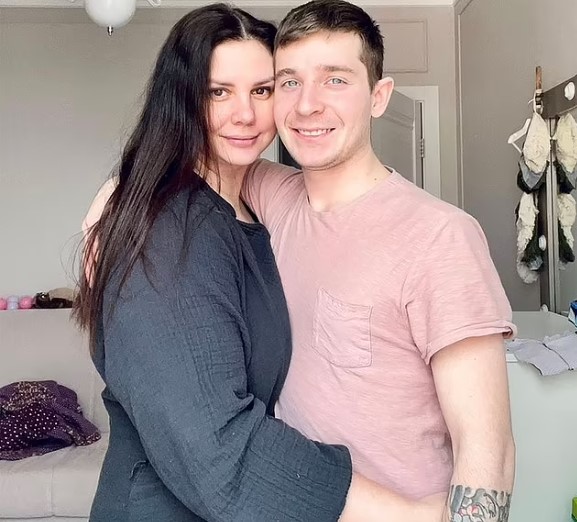
In order to click on white sofa in this screenshot , I will do `click(63, 346)`.